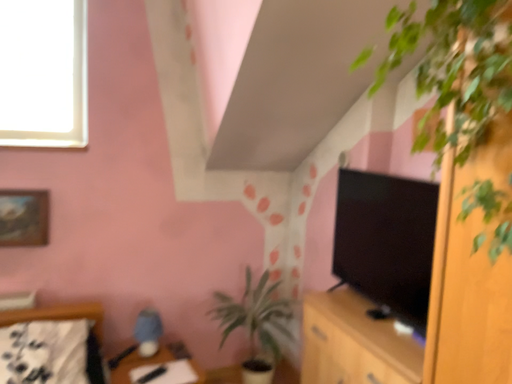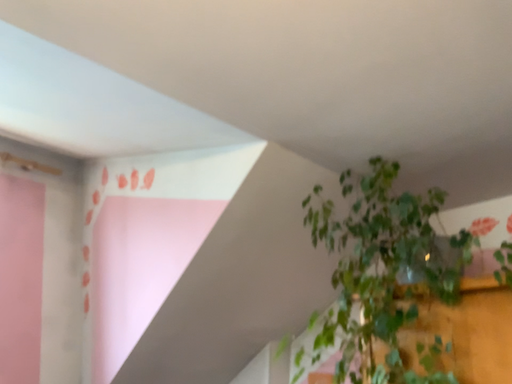
Question: How did the camera likely rotate when shooting the video?

Choices:
 (A) rotated upward
 (B) rotated downward

Answer: (A)